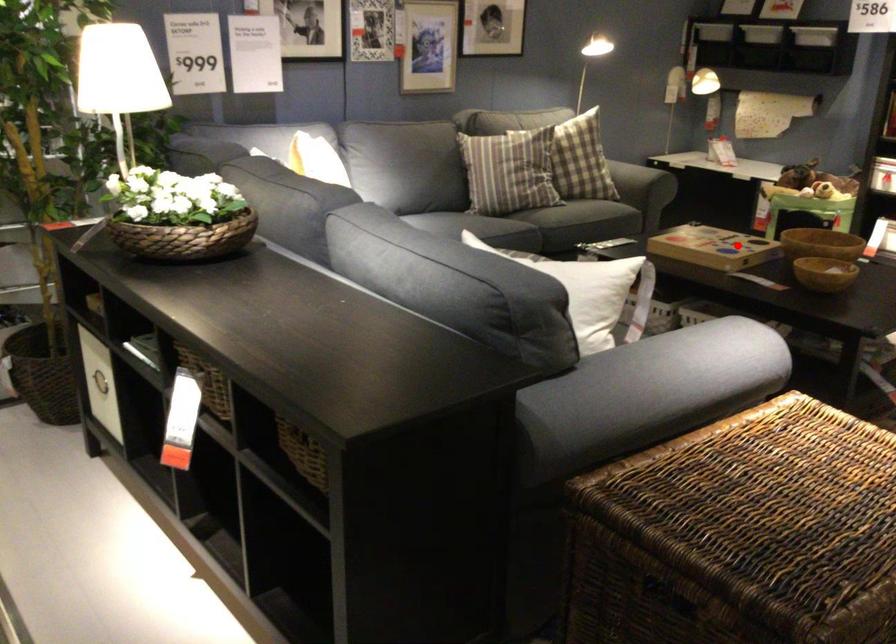
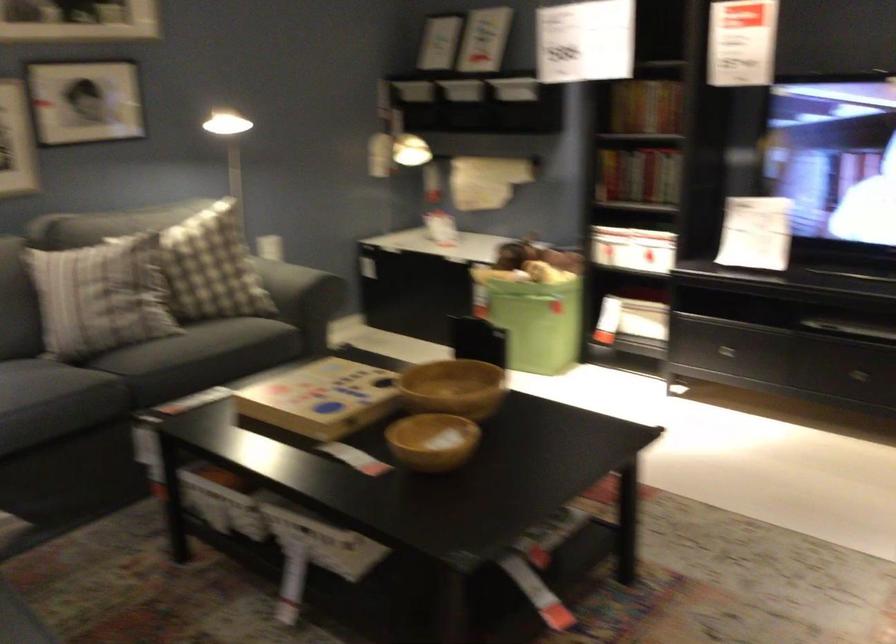
In the second image, find the point that corresponds to the highlighted location in the first image.

(320, 399)